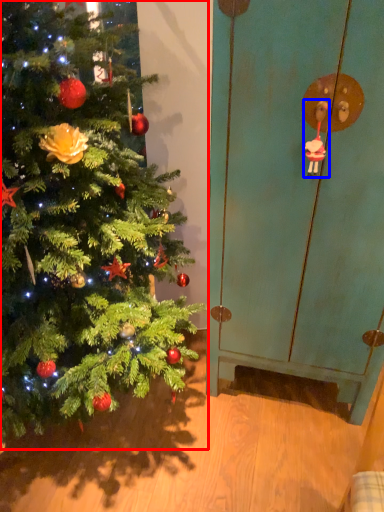
Question: Among these objects, which one is farthest to the camera, christmas tree (highlighted by a red box) or toy (highlighted by a blue box)?

Choices:
 (A) christmas tree
 (B) toy

Answer: (B)